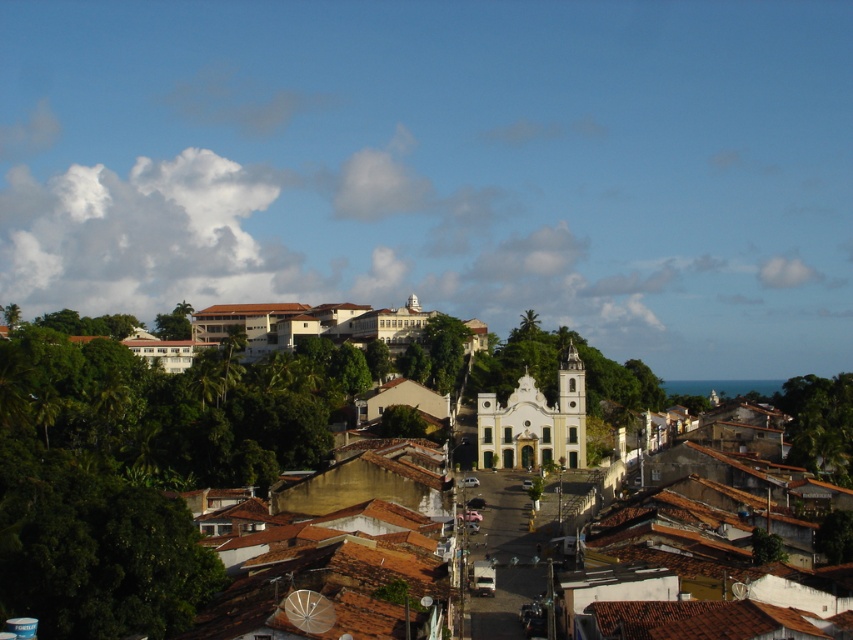
Can you confirm if green leafy tree at lower right is smaller than green leafy tree at center?

No, green leafy tree at lower right is not smaller than green leafy tree at center.

Is point (845, 376) farther from viewer compared to point (415, 428)?

Yes, it is.

Identify the location of green leafy tree at lower right. The height and width of the screenshot is (640, 853). (819, 422).

This screenshot has height=640, width=853. What do you see at coordinates (137, 470) in the screenshot? I see `white stucco church at center` at bounding box center [137, 470].

Can you confirm if white stucco church at center is positioned to the left of green leafy tree at center?

Correct, you'll find white stucco church at center to the left of green leafy tree at center.

Who is more forward, (x=267, y=388) or (x=424, y=426)?

Positioned in front is point (x=424, y=426).

You are a GUI agent. You are given a task and a screenshot of the screen. Output one action in this format:
    pyautogui.click(x=<x>, y=<y>)
    Task: Click on the white stucco church at center
    This screenshot has height=640, width=853.
    Given the screenshot: What is the action you would take?
    pyautogui.click(x=137, y=470)

Is white stucco church at center taller than green leafy tree at lower right?

Correct, white stucco church at center is much taller as green leafy tree at lower right.

Does point (318, 456) come behind point (840, 467)?

Yes, point (318, 456) is farther from viewer.

The width and height of the screenshot is (853, 640). What are the coordinates of `white stucco church at center` in the screenshot? It's located at (137, 470).